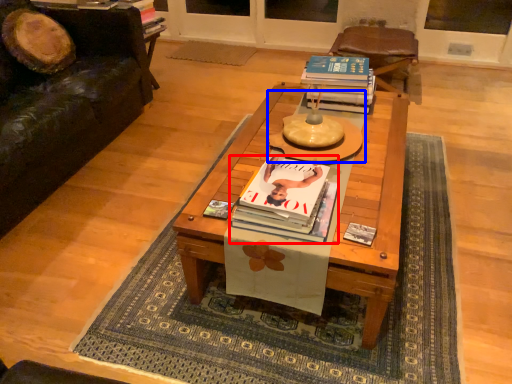
Question: Among these objects, which one is nearest to the camera, book (highlighted by a red box) or round table (highlighted by a blue box)?

Choices:
 (A) book
 (B) round table

Answer: (A)